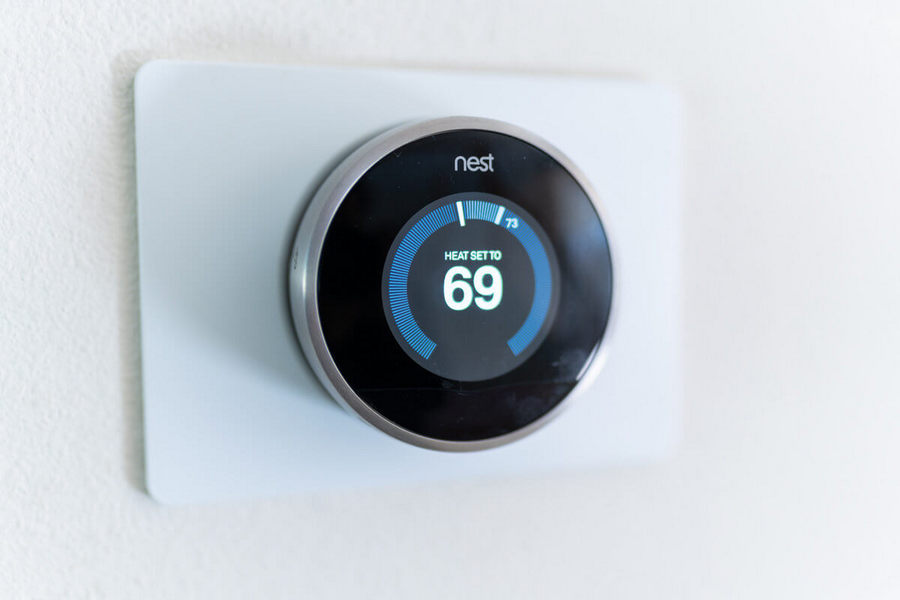
You are a GUI agent. You are given a task and a screenshot of the screen. Output one action in this format:
    pyautogui.click(x=<x>, y=<y>)
    Task: Click on the thermostat device
    The image size is (900, 600).
    Given the screenshot: What is the action you would take?
    (383, 203)